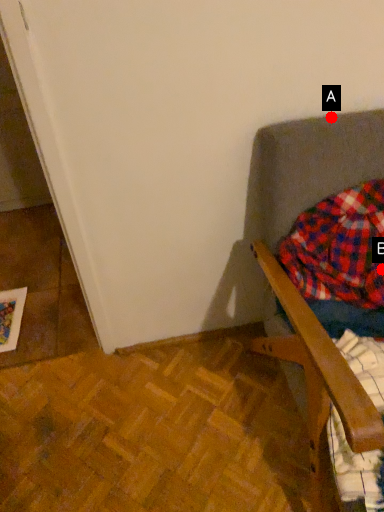
Question: Two points are circled on the image, labeled by A and B beside each circle. Which of the following is the farthest from the observer?

Choices:
 (A) A is further
 (B) B is further

Answer: (B)